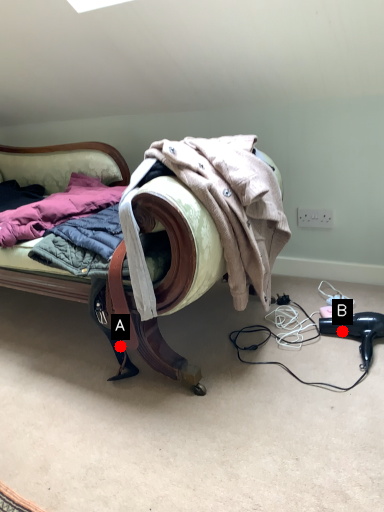
Question: Two points are circled on the image, labeled by A and B beside each circle. Which point is farther from the camera taking this photo?

Choices:
 (A) A is further
 (B) B is further

Answer: (B)